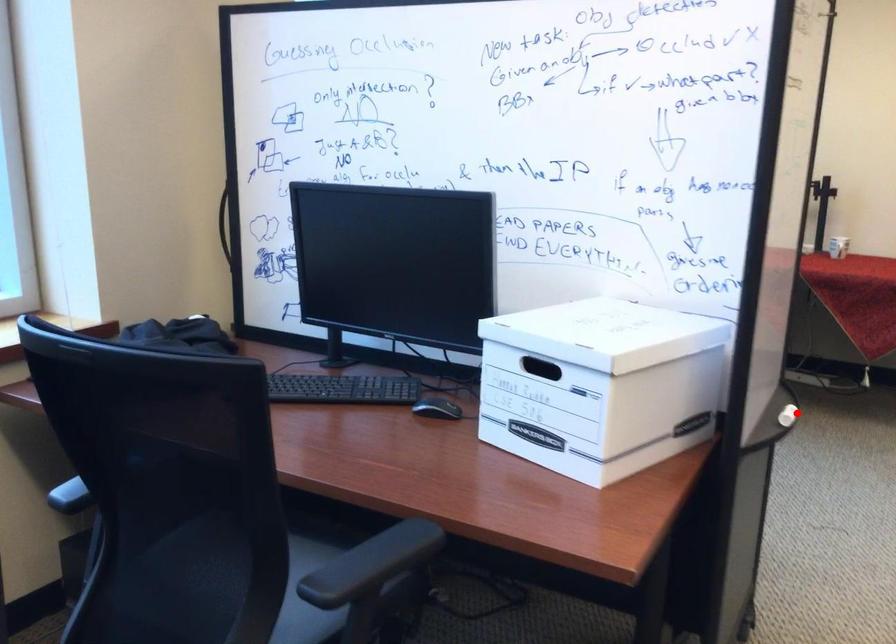
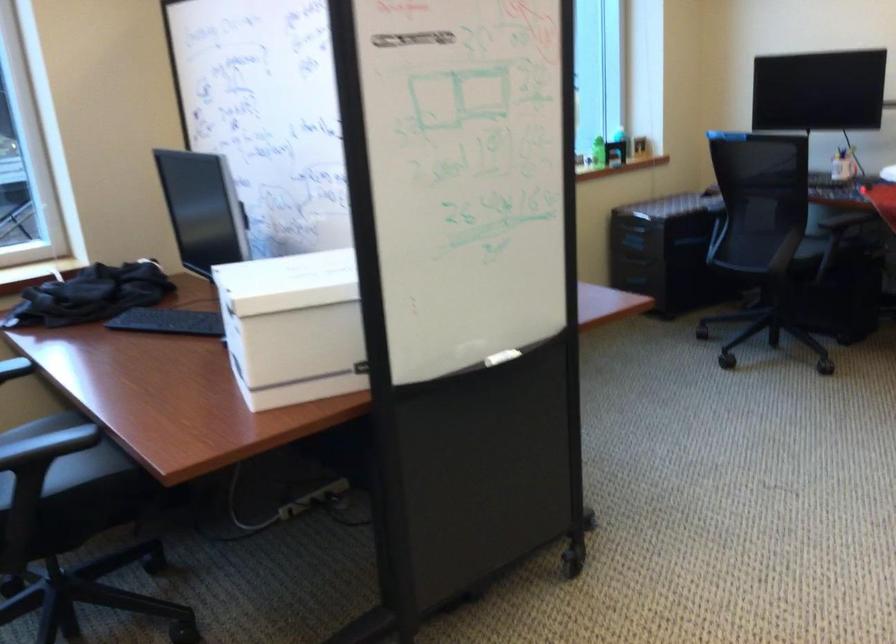
Locate, in the second image, the point that corresponds to the highlighted location in the first image.

(502, 357)